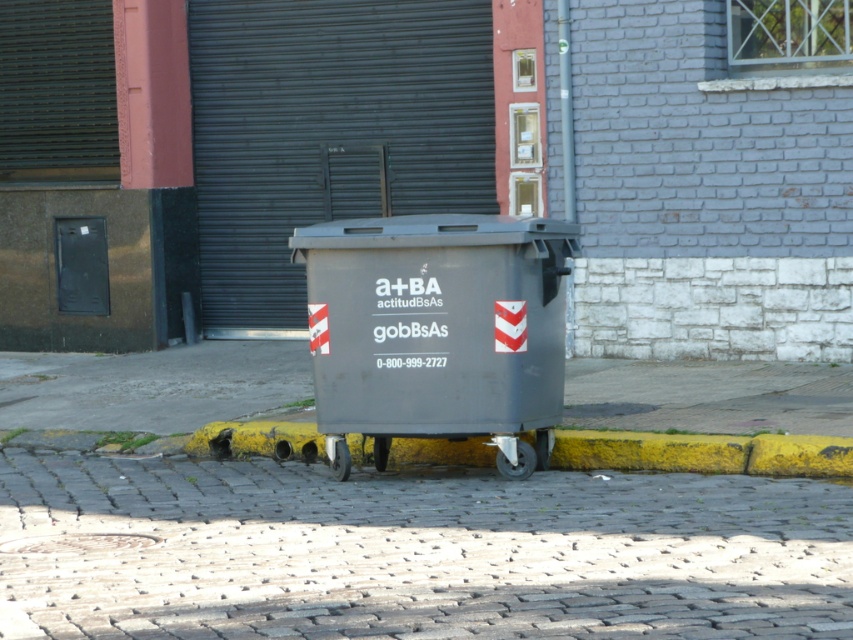
Question: Does cobblestone pavement at center appear under yellow painted curb at lower center?

Choices:
 (A) no
 (B) yes

Answer: (B)

Question: Which point is closer to the camera taking this photo?

Choices:
 (A) (566, 497)
 (B) (680, 449)
 (C) (534, 314)

Answer: (A)

Question: Which object is the closest to the yellow painted curb at lower center?

Choices:
 (A) cobblestone pavement at center
 (B) gray plastic recycling bin at center

Answer: (B)

Question: From the image, what is the correct spatial relationship of cobblestone pavement at center in relation to gray plastic recycling bin at center?

Choices:
 (A) left
 (B) right

Answer: (A)

Question: Which of these objects is positioned closest to the gray plastic recycling bin at center?

Choices:
 (A) cobblestone pavement at center
 (B) yellow painted curb at lower center

Answer: (B)

Question: Is cobblestone pavement at center bigger than gray plastic recycling bin at center?

Choices:
 (A) no
 (B) yes

Answer: (A)